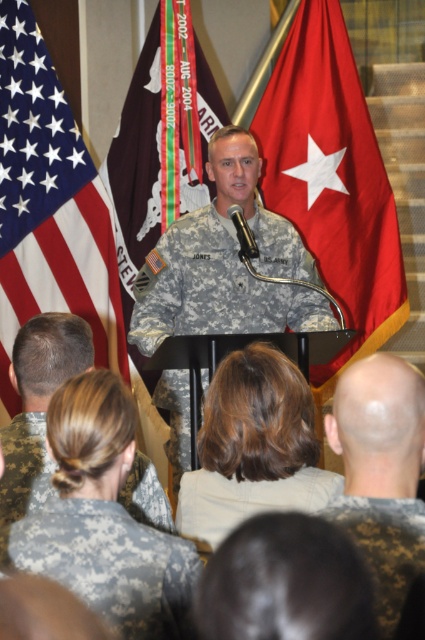
Question: Among these objects, which one is farthest from the camera?

Choices:
 (A) digital camouflage uniform at lower left
 (B) american flag at upper left
 (C) camouflage fabric uniform at lower right
 (D) white knit sweater at center

Answer: (B)

Question: Which object is farther from the camera taking this photo?

Choices:
 (A) red fabric flag at center
 (B) american flag at center
 (C) camouflage uniform at center
 (D) white knit sweater at center

Answer: (B)

Question: Does american flag at upper left appear on the right side of digital camouflage uniform at lower left?

Choices:
 (A) no
 (B) yes

Answer: (A)

Question: Does camouflage fabric uniform at center have a lesser width compared to american flag at center?

Choices:
 (A) no
 (B) yes

Answer: (A)

Question: Can you confirm if red fabric flag at center is wider than american flag at center?

Choices:
 (A) yes
 (B) no

Answer: (A)

Question: Among these objects, which one is nearest to the camera?

Choices:
 (A) american flag at upper left
 (B) camouflage fabric uniform at center
 (C) red fabric flag at center

Answer: (B)